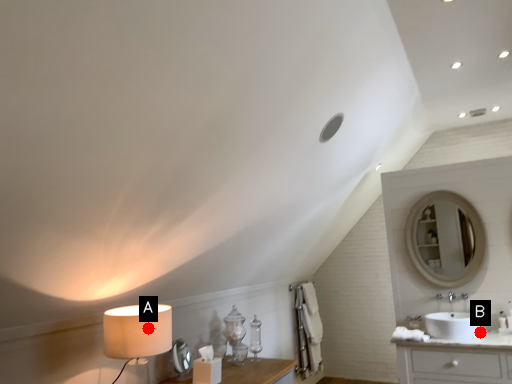
Question: Two points are circled on the image, labeled by A and B beside each circle. Which of the following is the closest to the observer?

Choices:
 (A) A is closer
 (B) B is closer

Answer: (A)